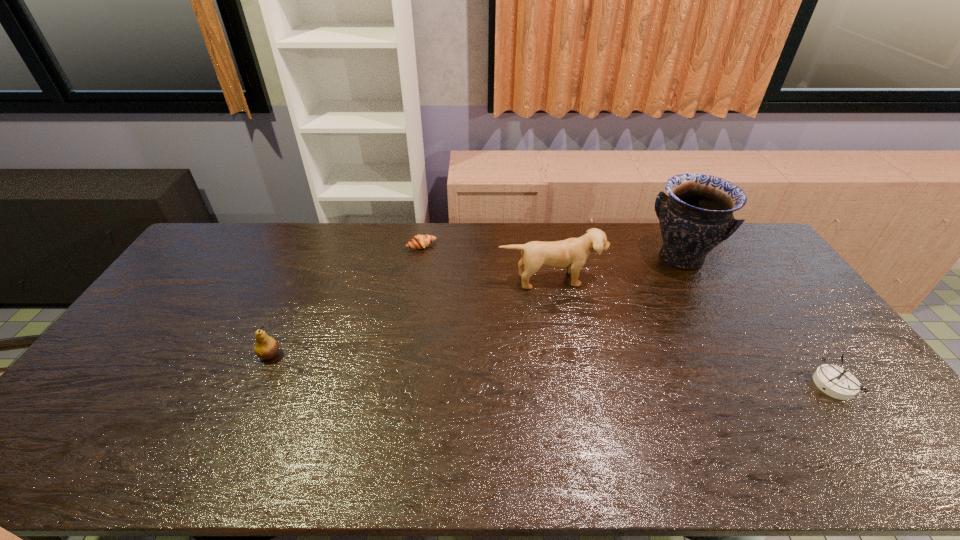
The image size is (960, 540). Identify the location of vacant spot on the desktop that is between the pear and the nearest object and is positioned on the front handle of the pottery. (613, 373).

The width and height of the screenshot is (960, 540). I want to click on free spot on the desktop that is between the third tallest object and the rightmost object and is positioned on the left side of the third object from left to right, so click(x=580, y=372).

Image resolution: width=960 pixels, height=540 pixels. Identify the location of vacant space on the desktop that is between the leftmost object and the second shortest object and is positioned on the front-facing side of the fourth object from right to left. (511, 368).